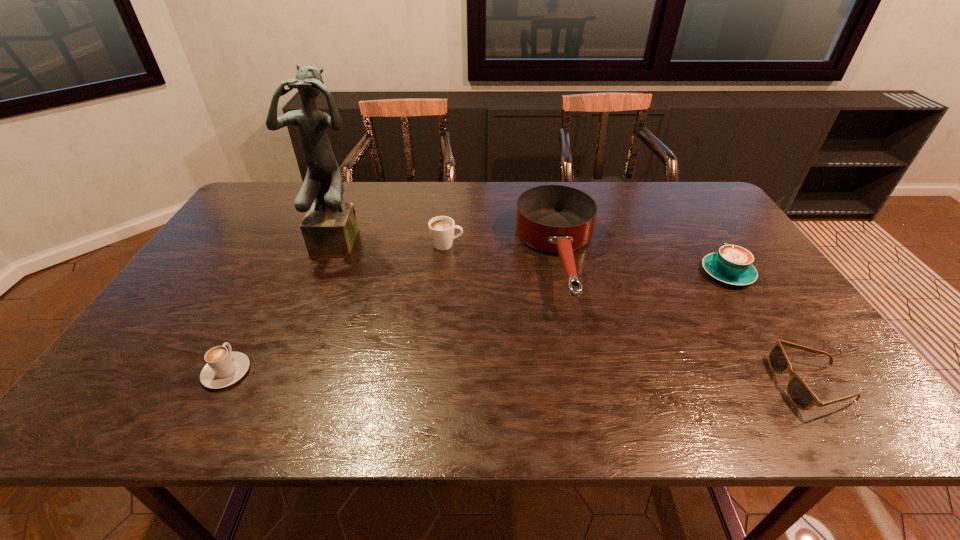
Image resolution: width=960 pixels, height=540 pixels. Find the location of `object identified as the third closest to the sunglasses`. object identified as the third closest to the sunglasses is located at coordinates (441, 228).

Where is `cappuccino that is the closest to the second tallest object`? This screenshot has height=540, width=960. cappuccino that is the closest to the second tallest object is located at coordinates (441, 228).

Locate which cappuccino ranks in proximity to the sculpture. Please provide its 2D coordinates. Your answer should be formatted as a tuple, i.e. [(x, y)], where the tuple contains the x and y coordinates of a point satisfying the conditions above.

[(441, 228)]

I want to click on vacant region that satisfies the following two spatial constraints: 1. with the handle on the side of the second cappuccino from right to left; 2. with the handle on the right side of the rightmost cappuccino, so click(x=444, y=273).